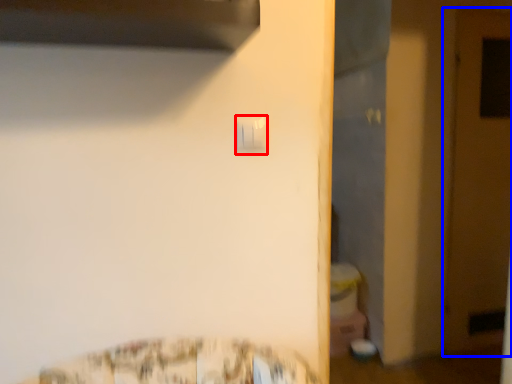
Question: Which object appears farthest to the camera in this image, light switch (highlighted by a red box) or door (highlighted by a blue box)?

Choices:
 (A) light switch
 (B) door

Answer: (B)